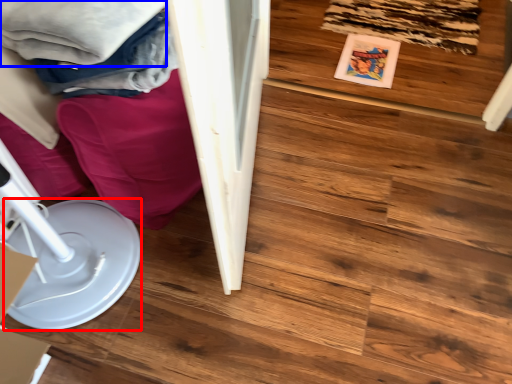
Question: Which point is further to the camera, paper plate (highlighted by a red box) or clothing (highlighted by a blue box)?

Choices:
 (A) paper plate
 (B) clothing

Answer: (B)